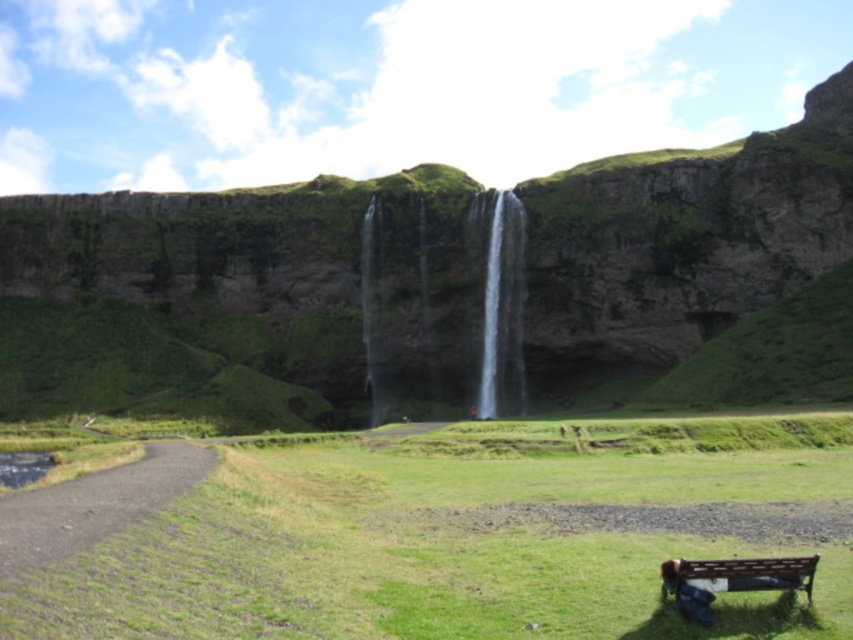
Question: Which point is closer to the camera taking this photo?

Choices:
 (A) (218, 221)
 (B) (93, 524)
 (C) (383, 360)

Answer: (B)

Question: Among these points, which one is nearest to the camera?

Choices:
 (A) 846,545
 (B) 260,221
 (C) 422,401
 (D) 498,285

Answer: (A)

Question: Which point is farther from the camera taking this photo?

Choices:
 (A) (480, 404)
 (B) (788, 285)
 (C) (761, 577)

Answer: (A)

Question: Is clear water at center thinner than transparent water at center?

Choices:
 (A) yes
 (B) no

Answer: (B)

Question: Is green grassy hillside at center below gray gravel path at lower left?

Choices:
 (A) no
 (B) yes

Answer: (A)

Question: Does clear water at center have a larger size compared to gray gravel path at lower left?

Choices:
 (A) no
 (B) yes

Answer: (B)